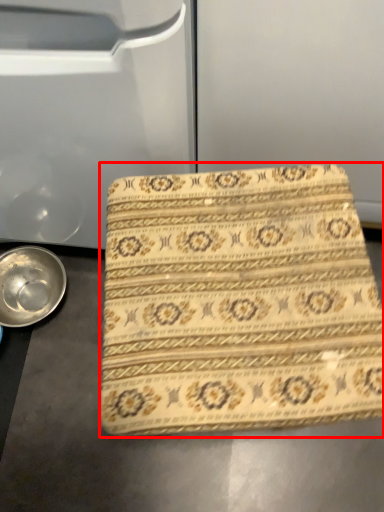
Question: From the image's perspective, where is beach towel (annotated by the red box) located in relation to bowl in the image?

Choices:
 (A) below
 (B) above

Answer: (A)